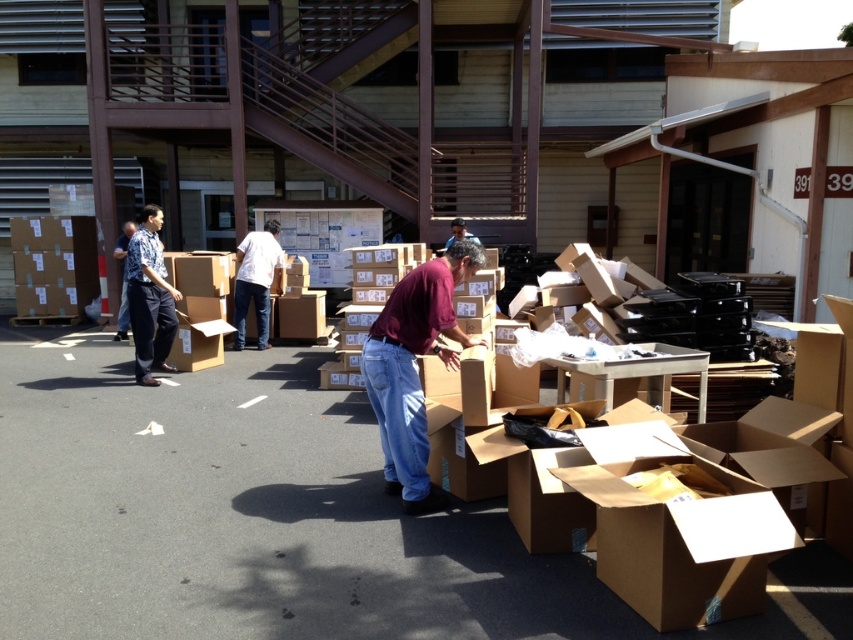
Consider the image. What is the exact coordinate of the maroon shirt at center in the image?

The maroon shirt at center is located at point (415, 368).

Please look at the point at coordinates (149, 298). What color is the shirt located there?

The shirt at point (149, 298) is dull blue.